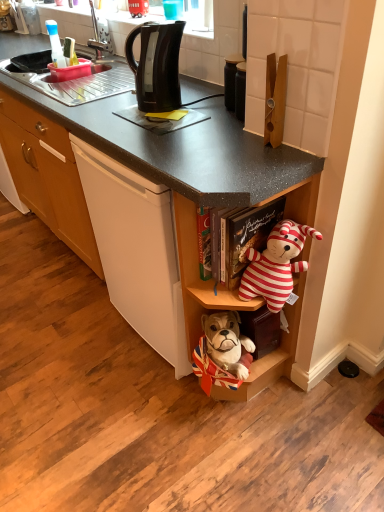
Locate an element on the screen. The width and height of the screenshot is (384, 512). free point in front of wooden shelf at lower center is located at coordinates (251, 451).